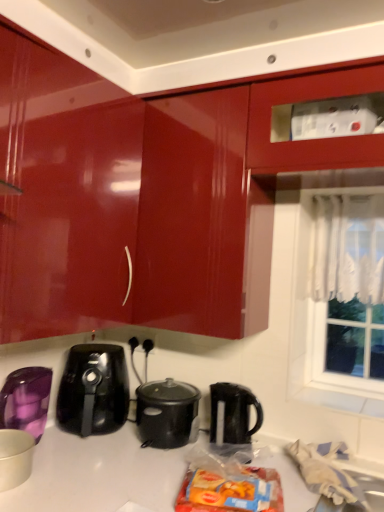
Question: Is black plastic kettle at center inside the boundaries of matte white bowl at lower left, positioned as the second kitchen appliance in back-to-front order, or outside?

Choices:
 (A) outside
 (B) inside

Answer: (A)

Question: Considering their positions, is black plastic kettle at center located in front of or behind matte white bowl at lower left, positioned as the 1th kitchen appliance in front-to-back order?

Choices:
 (A) front
 (B) behind

Answer: (B)

Question: Which of these objects is positioned closest to the matte white bowl at lower left, positioned as the second kitchen appliance in back-to-front order?

Choices:
 (A) black glossy air fryer at lower center
 (B) black matte slow cooker at center
 (C) glossy red cabinet at upper center
 (D) white lace curtain at right
 (E) white lace curtain at upper right

Answer: (A)

Question: Based on their relative distances, which object is nearer to the black plastic kettle at center?

Choices:
 (A) purple glossy cup at lower left, placed as the 2th kitchen appliance when sorted from front to back
 (B) glossy red cabinet at upper center
 (C) white lace curtain at upper right
 (D) black matte slow cooker at center
 (E) matte white bowl at lower left, positioned as the second kitchen appliance in back-to-front order

Answer: (D)